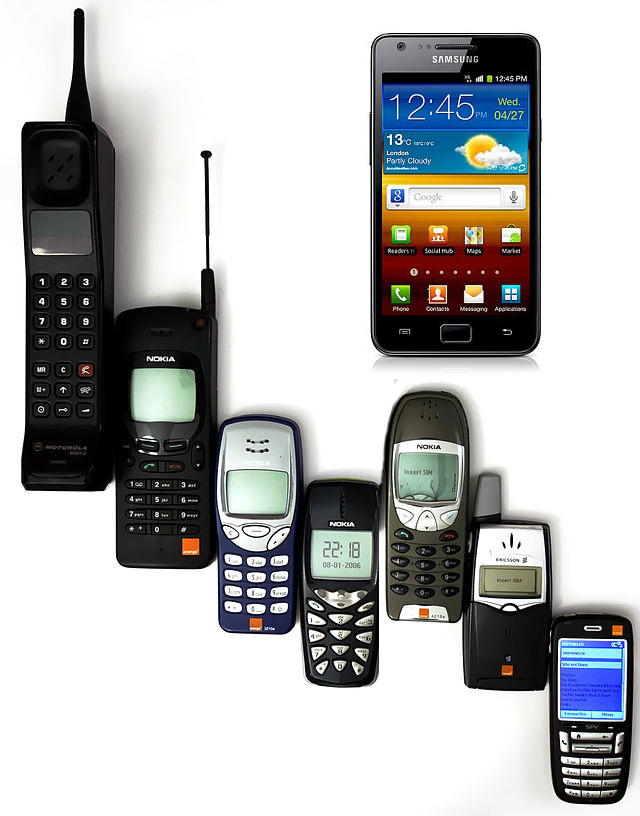
Locate an element on the screen. speaker is located at coordinates (60, 166), (152, 329), (251, 446), (340, 506), (417, 413), (522, 543), (587, 626), (452, 45).